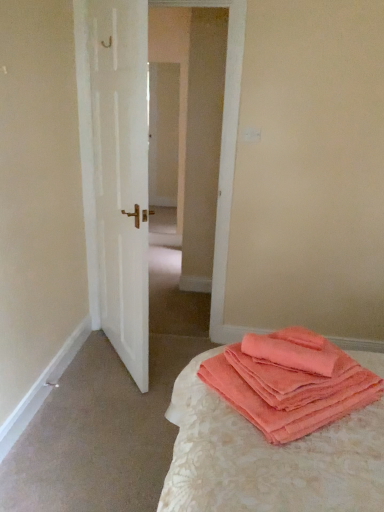
At what (x,y) coordinates should I click in order to perform the action: click on coral fleece towels at lower right. Please return your answer as a coordinate pair (x, y). Looking at the image, I should click on (288, 354).

From a real-world perspective, is coral terry cloth towels at lower right below coral fleece towels at lower right?

Yes, from a real-world perspective, coral terry cloth towels at lower right is beneath coral fleece towels at lower right.

Who is taller, coral terry cloth towels at lower right or coral fleece towels at lower right?

With more height is coral terry cloth towels at lower right.

Is the surface of coral terry cloth towels at lower right in direct contact with coral fleece towels at lower right?

No, coral terry cloth towels at lower right is not next to coral fleece towels at lower right.

From the picture: Is coral terry cloth towels at lower right in front of or behind coral fleece towels at lower right in the image?

In the image, coral terry cloth towels at lower right appears in front of coral fleece towels at lower right.

Is white matte door at left placed right next to coral fleece towels at lower right?

white matte door at left and coral fleece towels at lower right are clearly separated.

Is point (110, 88) positioned before point (250, 341)?

No, it is not.

At what (x,y) coordinates should I click in order to perform the action: click on cloth that appears on the right of white matte door at left. Please return your answer as a coordinate pair (x, y). This screenshot has height=512, width=384. Looking at the image, I should click on (288, 354).

Looking at their sizes, would you say white matte door at left is wider or thinner than coral fleece towels at lower right?

white matte door at left is thinner than coral fleece towels at lower right.

Which object is further away from the camera, coral terry cloth towels at lower right or white matte door at left?

white matte door at left is further away from the camera.

Can you confirm if coral terry cloth towels at lower right is shorter than white matte door at left?

Correct, coral terry cloth towels at lower right is not as tall as white matte door at left.

How many degrees apart are the facing directions of coral terry cloth towels at lower right and white matte door at left?

There is a 93.6-degree angle between the facing directions of coral terry cloth towels at lower right and white matte door at left.

Is coral terry cloth towels at lower right completely or partially outside of white matte door at left?

Absolutely, coral terry cloth towels at lower right is external to white matte door at left.

From the image's perspective, is coral fleece towels at lower right on top of coral terry cloth towels at lower right?

Correct, coral fleece towels at lower right appears higher than coral terry cloth towels at lower right in the image.

The image size is (384, 512). I want to click on cloth on the left of coral terry cloth towels at lower right, so click(288, 354).

Looking at this image, is coral fleece towels at lower right in front of or behind coral terry cloth towels at lower right in the image?

coral fleece towels at lower right is behind coral terry cloth towels at lower right.

How different are the orientations of coral fleece towels at lower right and coral terry cloth towels at lower right in degrees?

The angular difference between coral fleece towels at lower right and coral terry cloth towels at lower right is 35.2 degrees.

Between white matte door at left and coral terry cloth towels at lower right, which one has smaller width?

With smaller width is white matte door at left.

Can you confirm if white matte door at left is bigger than coral terry cloth towels at lower right?

Correct, white matte door at left is larger in size than coral terry cloth towels at lower right.

Could you tell me if white matte door at left is turned towards coral terry cloth towels at lower right?

No, white matte door at left is not turned towards coral terry cloth towels at lower right.

Which object is further away from the camera, coral fleece towels at lower right or white matte door at left?

white matte door at left is more distant.

Measure the distance between coral fleece towels at lower right and white matte door at left.

The distance of coral fleece towels at lower right from white matte door at left is 1.18 meters.

Does coral fleece towels at lower right appear on the right side of white matte door at left?

Yes, coral fleece towels at lower right is to the right of white matte door at left.

Based on the photo, considering the relative sizes of coral fleece towels at lower right and white matte door at left in the image provided, is coral fleece towels at lower right smaller than white matte door at left?

Yes.

You are a GUI agent. You are given a task and a screenshot of the screen. Output one action in this format:
    pyautogui.click(x=<x>, y=<y>)
    Task: Click on the cloth lying on the left of coral terry cloth towels at lower right
    This screenshot has height=512, width=384.
    Given the screenshot: What is the action you would take?
    pyautogui.click(x=288, y=354)

This screenshot has height=512, width=384. What are the coordinates of `door that appears behind the coral fleece towels at lower right` in the screenshot? It's located at (121, 175).

Which object lies nearer to the anchor point white matte door at left, coral fleece towels at lower right or coral terry cloth towels at lower right?

coral terry cloth towels at lower right is closer to white matte door at left.

From the image, which object appears to be farther from coral fleece towels at lower right, coral terry cloth towels at lower right or white matte door at left?

Among the two, white matte door at left is located further to coral fleece towels at lower right.

When comparing their distances from coral fleece towels at lower right, does white matte door at left or coral terry cloth towels at lower right seem further?

white matte door at left is positioned further to the anchor coral fleece towels at lower right.

Looking at the image, which one is located further to white matte door at left, coral terry cloth towels at lower right or coral fleece towels at lower right?

coral fleece towels at lower right is further to white matte door at left.

Based on the photo, which object lies nearer to the anchor point coral terry cloth towels at lower right, white matte door at left or coral fleece towels at lower right?

coral fleece towels at lower right is closer to coral terry cloth towels at lower right.

Which object lies further to the anchor point coral terry cloth towels at lower right, coral fleece towels at lower right or white matte door at left?

The object further to coral terry cloth towels at lower right is white matte door at left.

Identify the location of cloth between white matte door at left and coral terry cloth towels at lower right from left to right. Image resolution: width=384 pixels, height=512 pixels. (288, 354).